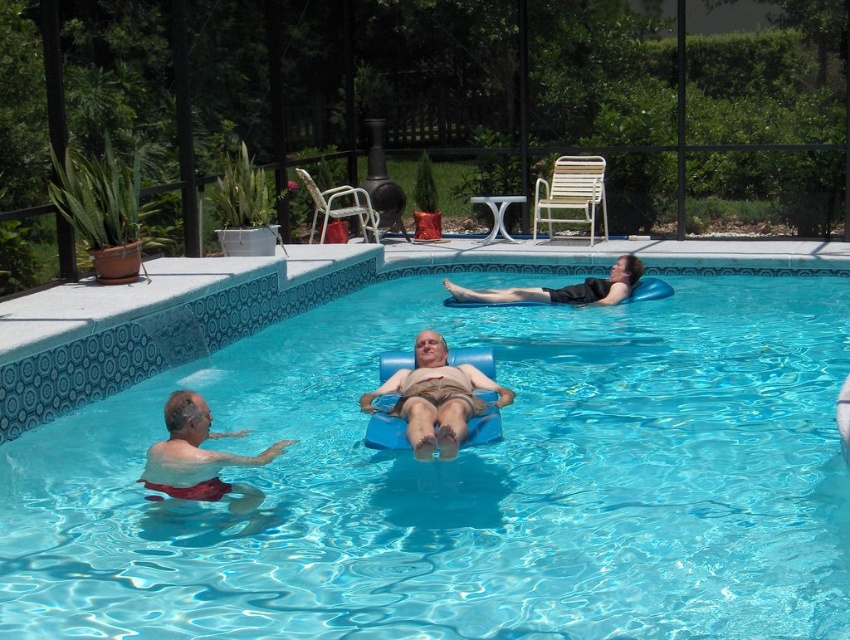
Question: Based on their relative distances, which object is farther from the transparent blue water at center?

Choices:
 (A) smooth tan skin at center
 (B) white matte shorts at lower left

Answer: (B)

Question: Where is transparent blue water at center located in relation to white matte shorts at lower left in the image?

Choices:
 (A) left
 (B) right

Answer: (B)

Question: Which object is the closest to the transparent blue water at center?

Choices:
 (A) white matte shorts at lower left
 (B) smooth tan skin at center
 (C) black fabric float at upper center

Answer: (B)

Question: Which of the following is the farthest from the observer?

Choices:
 (A) white matte shorts at lower left
 (B) smooth tan skin at center
 (C) black fabric float at upper center
 (D) transparent blue water at center

Answer: (C)

Question: Can you confirm if smooth tan skin at center is wider than white matte shorts at lower left?

Choices:
 (A) no
 (B) yes

Answer: (B)

Question: Is smooth tan skin at center thinner than white matte shorts at lower left?

Choices:
 (A) no
 (B) yes

Answer: (A)